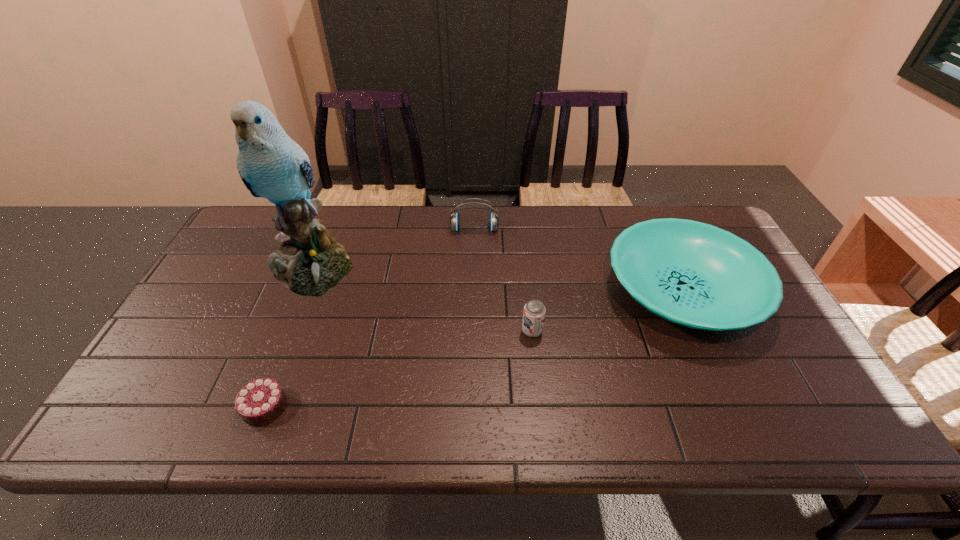
Image resolution: width=960 pixels, height=540 pixels. What are the coordinates of `blank region between the second object from right to left and the headset` in the screenshot? It's located at (503, 280).

This screenshot has height=540, width=960. What are the coordinates of `free space between the farthest object and the dish` in the screenshot? It's located at pyautogui.click(x=578, y=261).

Where is `vacant space that's between the chocolate cake and the rightmost object`? The width and height of the screenshot is (960, 540). vacant space that's between the chocolate cake and the rightmost object is located at coordinates (473, 349).

The width and height of the screenshot is (960, 540). Identify the location of object that stands as the second closest to the fourth object from left to right. (454, 220).

Identify which object is located as the second nearest to the rightmost object. Please provide its 2D coordinates. Your answer should be formatted as a tuple, i.e. [(x, y)], where the tuple contains the x and y coordinates of a point satisfying the conditions above.

[(454, 220)]

Find the location of a particular element. free spot that satisfies the following two spatial constraints: 1. on the face of the parakeet; 2. on the right side of the rightmost object is located at coordinates (301, 292).

I want to click on vacant point that satisfies the following two spatial constraints: 1. on the back side of the second object from right to left; 2. on the left side of the nearest object, so click(x=294, y=331).

This screenshot has height=540, width=960. In order to click on vacant space that satisfies the following two spatial constraints: 1. on the face of the fourth object from left to right; 2. on the right side of the parakeet in this screenshot , I will do `click(286, 331)`.

Where is `free spot that satisfies the following two spatial constraints: 1. on the ear cups of the headset; 2. on the right side of the fourth object from left to right`? Image resolution: width=960 pixels, height=540 pixels. free spot that satisfies the following two spatial constraints: 1. on the ear cups of the headset; 2. on the right side of the fourth object from left to right is located at coordinates (473, 331).